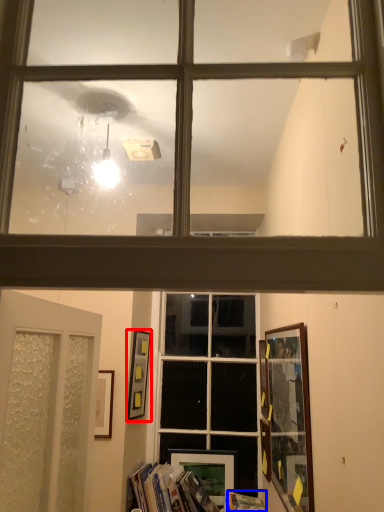
Question: Which object is closer to the camera taking this photo, picture frame (highlighted by a red box) or paperback book (highlighted by a blue box)?

Choices:
 (A) picture frame
 (B) paperback book

Answer: (B)